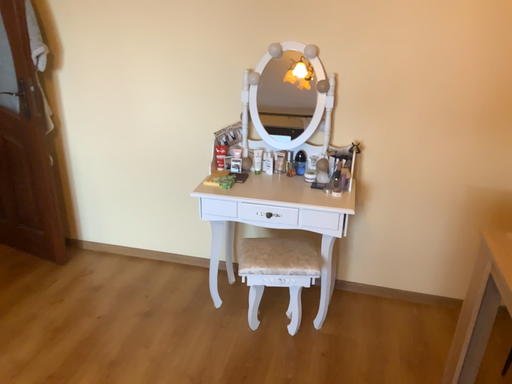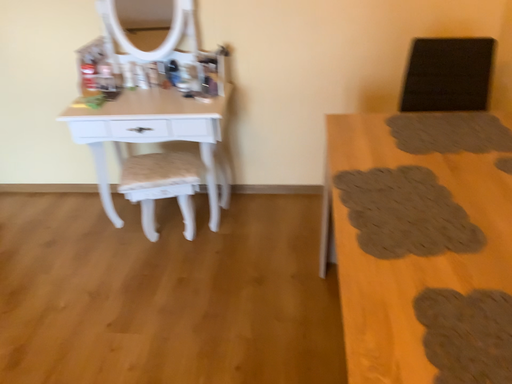
Question: Which way did the camera rotate in the video?

Choices:
 (A) rotated upward
 (B) rotated downward

Answer: (B)